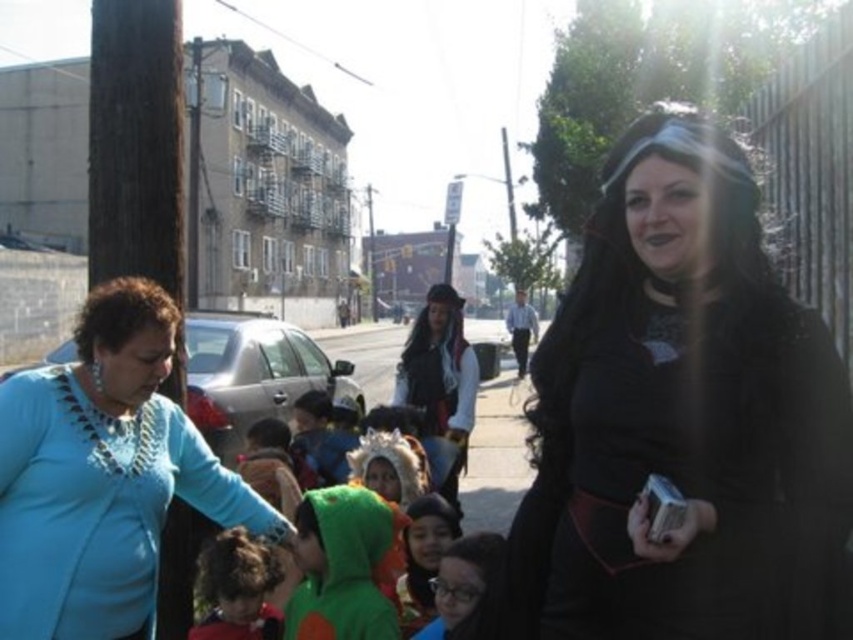
Is velvet green costume at center positioned behind curly brown hair at lower left?

No.

Between point (340, 563) and point (233, 573), which one is positioned behind?

Point (233, 573)

Is point (369, 595) positioned behind point (221, 564)?

Yes, point (369, 595) is behind point (221, 564).

What are the coordinates of `velvet green costume at center` in the screenshot? It's located at (341, 566).

Can you confirm if black matte dress at center is positioned above velvet green costume at center?

Yes.

From the picture: Who is lower down, black matte dress at center or velvet green costume at center?

velvet green costume at center is lower down.

Who is more distant from viewer, (747,483) or (390,531)?

Positioned behind is point (390,531).

The height and width of the screenshot is (640, 853). Find the location of `black matte dress at center`. black matte dress at center is located at coordinates (682, 419).

Can you confirm if blue matte shirt at lower left is bigger than velvet green costume at center?

Actually, blue matte shirt at lower left might be smaller than velvet green costume at center.

Is point (48, 467) positioned behind point (306, 595)?

No, it is in front of (306, 595).

Does point (15, 609) come in front of point (341, 492)?

Yes, point (15, 609) is closer to viewer.

You are a GUI agent. You are given a task and a screenshot of the screen. Output one action in this format:
    pyautogui.click(x=<x>, y=<y>)
    Task: Click on the blue matte shirt at lower left
    
    Given the screenshot: What is the action you would take?
    pyautogui.click(x=103, y=476)